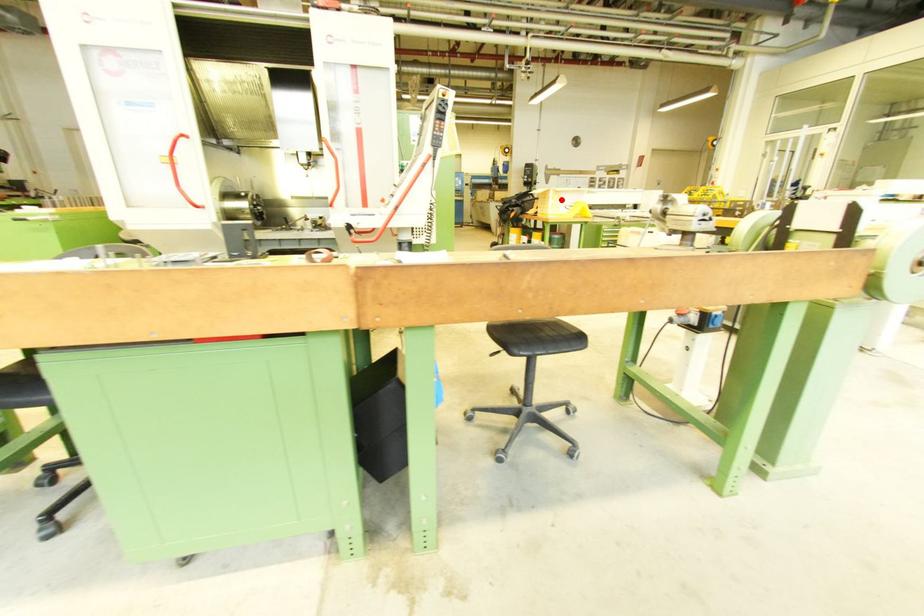
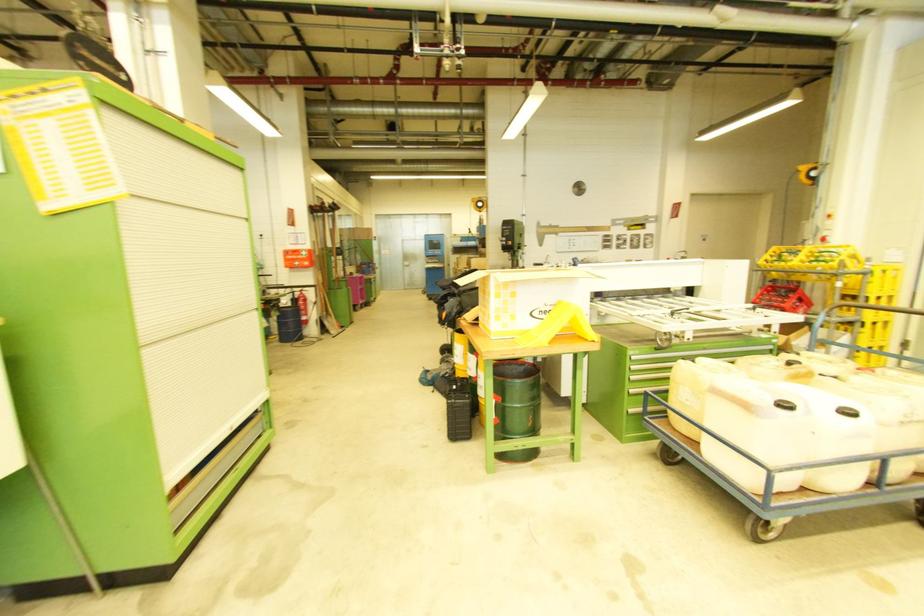
Locate, in the second image, the point that corresponds to the highlighted location in the first image.

(516, 297)